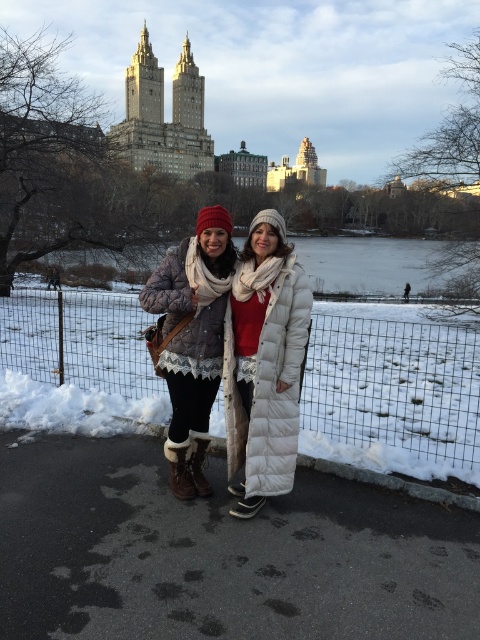
Question: Estimate the real-world distances between objects in this image. Which object is closer to the metal wire fence at lower center?

Choices:
 (A) white down jacket at center
 (B) matte black jacket at center

Answer: (B)

Question: Considering the relative positions of metal wire fence at lower center and white down jacket at center in the image provided, where is metal wire fence at lower center located with respect to white down jacket at center?

Choices:
 (A) right
 (B) left

Answer: (B)

Question: Which of these objects is positioned farthest from the white down jacket at center?

Choices:
 (A) metal wire fence at lower center
 (B) matte black jacket at center

Answer: (A)

Question: Does metal wire fence at lower center come behind matte black jacket at center?

Choices:
 (A) yes
 (B) no

Answer: (A)

Question: Can you confirm if matte black jacket at center is smaller than white down jacket at center?

Choices:
 (A) no
 (B) yes

Answer: (A)

Question: Estimate the real-world distances between objects in this image. Which object is farther from the metal wire fence at lower center?

Choices:
 (A) matte black jacket at center
 (B) white down jacket at center

Answer: (B)